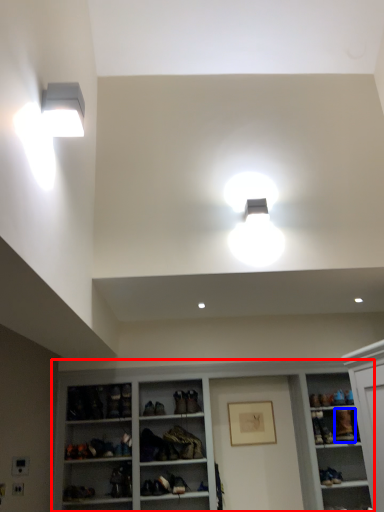
Question: Which object is further to the camera taking this photo, shelf (highlighted by a red box) or shoe (highlighted by a blue box)?

Choices:
 (A) shelf
 (B) shoe

Answer: (B)